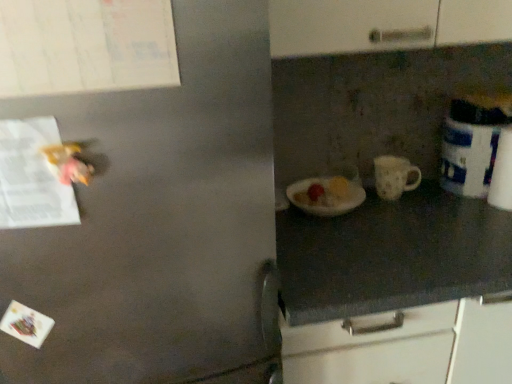
Question: Can you see white glossy canister at right touching white paper at left?

Choices:
 (A) yes
 (B) no

Answer: (B)

Question: Does white glossy canister at right appear on the right side of white paper at left?

Choices:
 (A) no
 (B) yes

Answer: (B)

Question: Does white glossy canister at right appear on the left side of white paper at left?

Choices:
 (A) yes
 (B) no

Answer: (B)

Question: Is white glossy canister at right not within white paper at left?

Choices:
 (A) no
 (B) yes

Answer: (B)

Question: From a real-world perspective, is white glossy canister at right located higher than white paper at left?

Choices:
 (A) yes
 (B) no

Answer: (B)

Question: Looking at the image, does white paper at left seem bigger or smaller compared to white matte mug at center?

Choices:
 (A) small
 (B) big

Answer: (A)

Question: Is white paper at left situated inside white matte mug at center or outside?

Choices:
 (A) outside
 (B) inside

Answer: (A)

Question: Is white paper at left taller or shorter than white matte mug at center?

Choices:
 (A) tall
 (B) short

Answer: (A)

Question: In terms of width, does white paper at left look wider or thinner when compared to white matte mug at center?

Choices:
 (A) thin
 (B) wide

Answer: (A)

Question: In terms of size, does white glossy canister at right appear bigger or smaller than white matte mug at center?

Choices:
 (A) big
 (B) small

Answer: (A)

Question: From a real-world perspective, is white glossy canister at right above or below white matte mug at center?

Choices:
 (A) below
 (B) above

Answer: (B)

Question: Considering the positions of point (480, 160) and point (377, 155), is point (480, 160) closer or farther from the camera than point (377, 155)?

Choices:
 (A) closer
 (B) farther

Answer: (A)

Question: Would you say white glossy canister at right is to the left or to the right of white matte mug at center in the picture?

Choices:
 (A) right
 (B) left

Answer: (A)

Question: Is white matte mug at center bigger or smaller than white paper at left?

Choices:
 (A) small
 (B) big

Answer: (B)

Question: Considering the positions of white matte mug at center and white paper at left in the image, is white matte mug at center wider or thinner than white paper at left?

Choices:
 (A) wide
 (B) thin

Answer: (A)